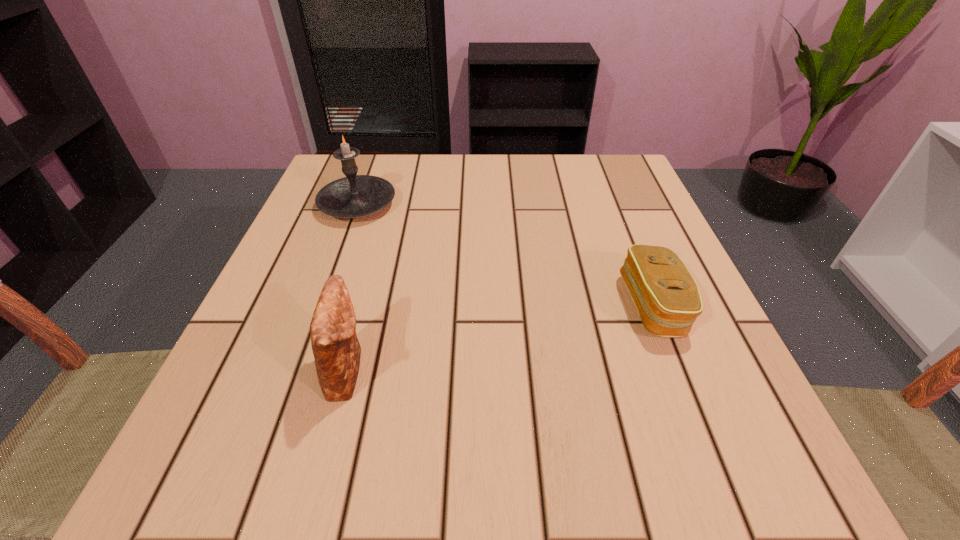
The width and height of the screenshot is (960, 540). Identify the location of candle. (353, 196).

Locate an element on the screen. the left clutch bag is located at coordinates (336, 349).

Where is `the taller clutch bag`? the taller clutch bag is located at coordinates (336, 349).

Identify the location of the rightmost object. The height and width of the screenshot is (540, 960). (667, 298).

Locate an element on the screen. Image resolution: width=960 pixels, height=540 pixels. the shorter clutch bag is located at coordinates (667, 298).

Image resolution: width=960 pixels, height=540 pixels. Identify the location of free spot located on the back of the candle. (372, 163).

This screenshot has width=960, height=540. I want to click on blank space located on the open side of the second shortest object, so click(456, 370).

Locate an element on the screen. Image resolution: width=960 pixels, height=540 pixels. free space located on the zipper side of the rightmost object is located at coordinates (470, 306).

Find the location of a particular element. The height and width of the screenshot is (540, 960). free space located 0.330m on the zipper side of the rightmost object is located at coordinates (428, 306).

At what (x,y) coordinates should I click in order to perform the action: click on free space located 0.370m on the zipper side of the rightmost object. Please return your answer as a coordinate pair (x, y). Looking at the image, I should click on (404, 306).